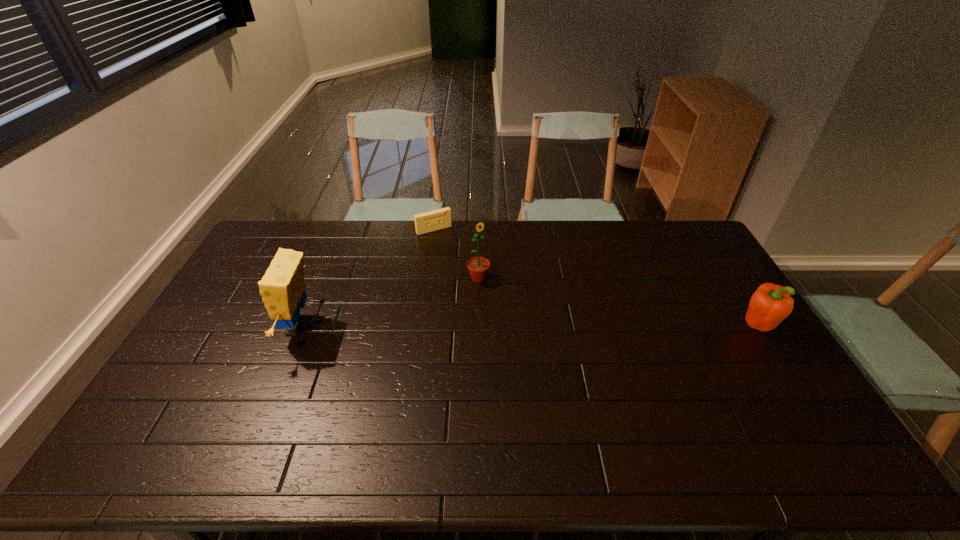
What are the coordinates of `free point between the second shortest object and the leftmost object` in the screenshot? It's located at 526,327.

Image resolution: width=960 pixels, height=540 pixels. In order to click on vacant space in between the second shortest object and the leftmost object in this screenshot , I will do `click(526, 327)`.

Where is `free space between the third object from right to left and the sunflower`? free space between the third object from right to left and the sunflower is located at coordinates (456, 254).

Identify the location of the second closest object to the third object from left to right. The height and width of the screenshot is (540, 960). (282, 288).

This screenshot has height=540, width=960. Identify the location of object that is the second closest to the second shortest object. (434, 220).

The image size is (960, 540). I want to click on vacant region that satisfies the following two spatial constraints: 1. on the front side of the second object from right to left; 2. on the left side of the third object from right to left, so click(x=427, y=279).